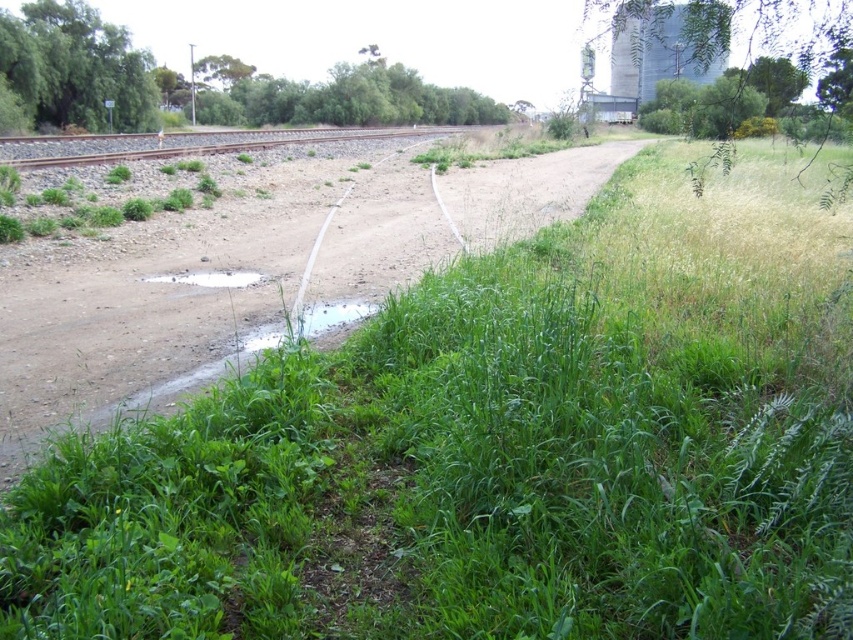
Between point (300, 330) and point (210, 278), which one is positioned in front?

Point (300, 330) is in front.

Is point (281, 337) farther from viewer compared to point (201, 273)?

No.

Image resolution: width=853 pixels, height=640 pixels. Identify the location of clear water at center. (308, 324).

Find the location of a particular element. clear water at center is located at coordinates (308, 324).